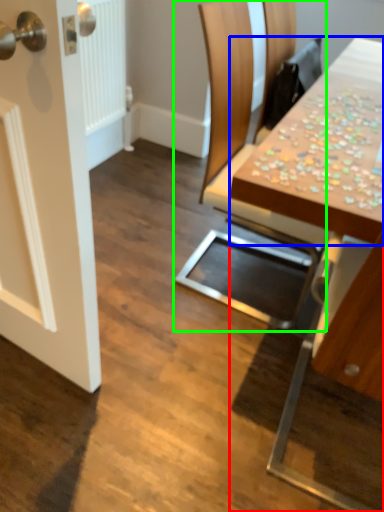
Question: Estimate the real-world distances between objects in this image. Which object is farther from table (highlighted by a red box), counter top (highlighted by a blue box) or chair (highlighted by a green box)?

Choices:
 (A) counter top
 (B) chair

Answer: (B)